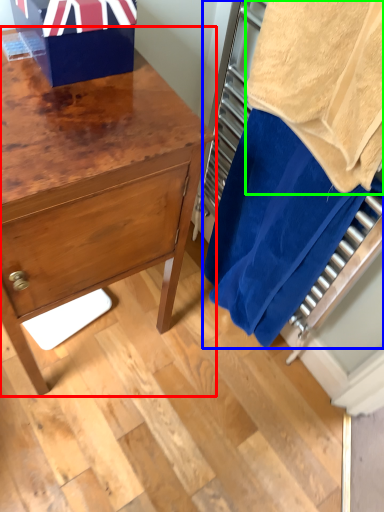
Question: Which object is the closest to the chest of drawers (highlighted by a red box)? Choose among these: laundry (highlighted by a blue box) or bath towel (highlighted by a green box).

Choices:
 (A) laundry
 (B) bath towel

Answer: (A)